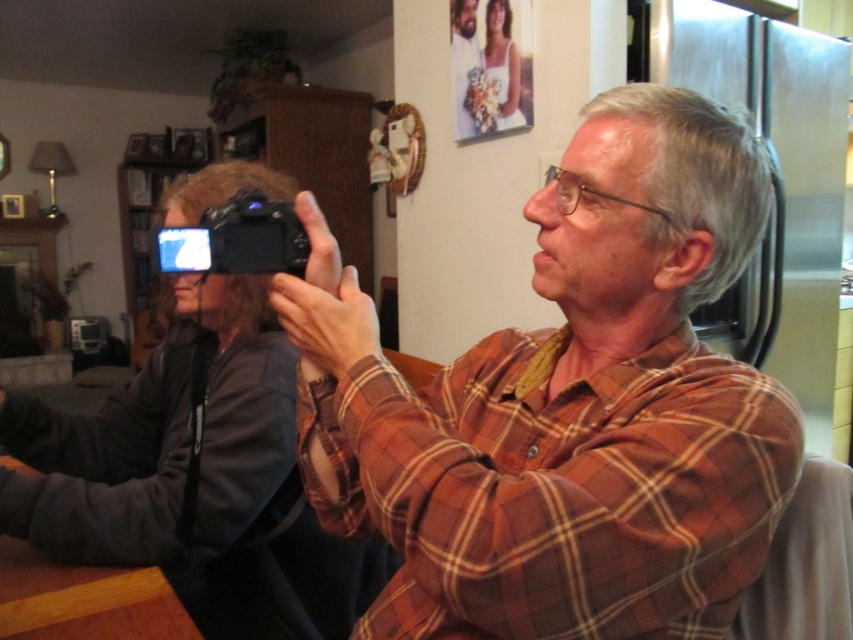
Between brown plaid shirt at center and black plastic camera at center, which one is positioned lower?

brown plaid shirt at center is lower down.

Does brown plaid shirt at center have a greater width compared to black plastic camera at center?

Indeed, brown plaid shirt at center has a greater width compared to black plastic camera at center.

Find the location of a particular element. The image size is (853, 640). brown plaid shirt at center is located at coordinates (566, 406).

Is brown plaid shirt at center above satin white dress at upper center?

Actually, brown plaid shirt at center is below satin white dress at upper center.

Which is more to the right, brown plaid shirt at center or satin white dress at upper center?

From the viewer's perspective, satin white dress at upper center appears more on the right side.

Who is more distant from viewer, [378,442] or [489,33]?

→ The point [489,33] is more distant.

I want to click on brown plaid shirt at center, so click(x=566, y=406).

Describe the element at coordinates (236, 240) in the screenshot. This screenshot has height=640, width=853. I see `black plastic camera at center` at that location.

Which is in front, point (276, 212) or point (506, 113)?

Point (276, 212)

Does point (257, 246) come behind point (492, 76)?

No, (257, 246) is closer to viewer.

Find the location of a particular element. black plastic camera at center is located at coordinates (236, 240).